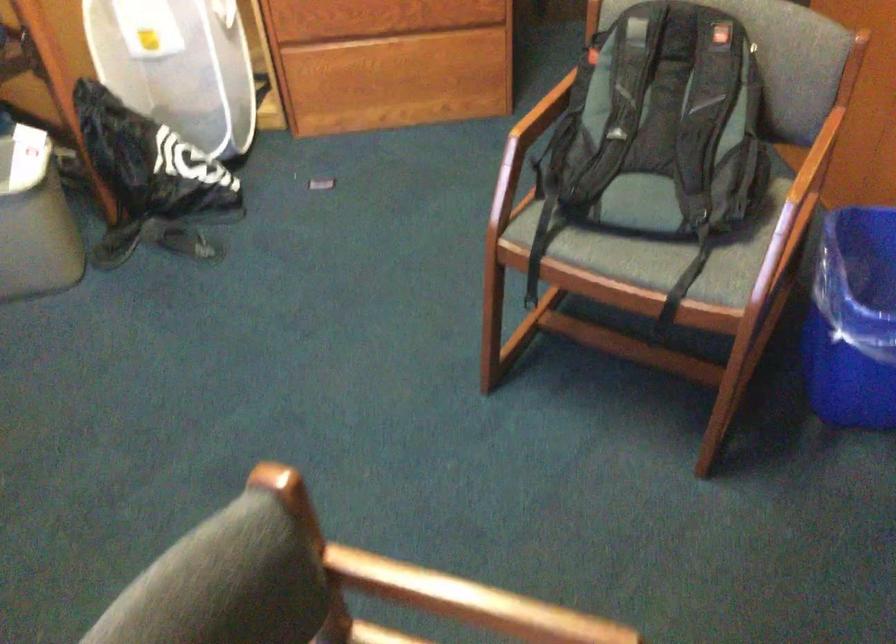
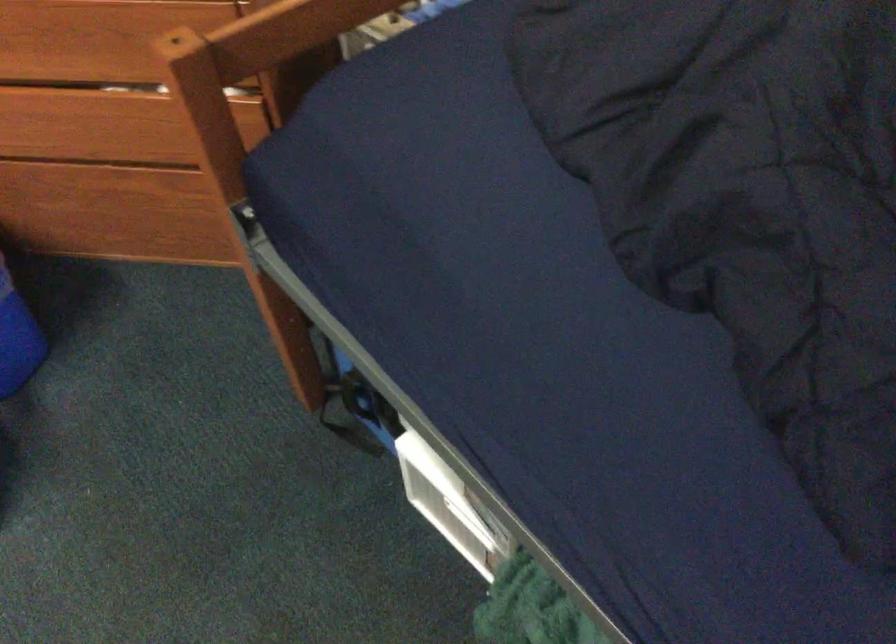
The first image is from the beginning of the video and the second image is from the end. How did the camera likely rotate when shooting the video?

The rotation direction of the camera is right-down.